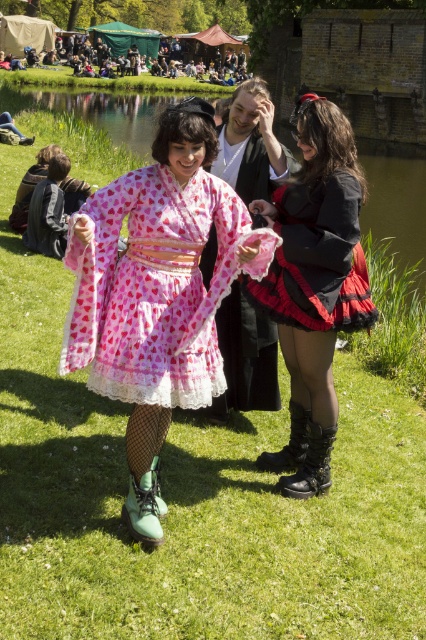
You are a photographer at the festival and want to capture a clear shot of both the pink lace dress at center and the black leather boots at center. Based on their positions, which one will be more visible in the photo?

The black leather boots at center will be more visible in the photo because the pink lace dress at center is positioned under them, partially obscuring it.

You are a photographer setting up a tripod to capture the festival scene. You notice the black leather boots at center and the green suede boot at lower center. Which boot should you focus on if you want to ensure the widest subject in the frame?

You should focus on the black leather boots at center because they are wider than the green suede boot at lower center.